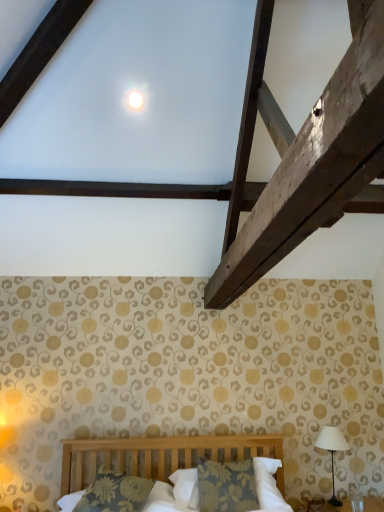
I want to click on white fabric-covered lampshade at right, so click(332, 451).

The image size is (384, 512). Describe the element at coordinates (135, 100) in the screenshot. I see `white glossy moonlight at upper center` at that location.

What is the approximate width of floral fabric pillow at center, marked as the first pillow in a right-to-left arrangement?

The width of floral fabric pillow at center, marked as the first pillow in a right-to-left arrangement, is 13.60 inches.

Identify the location of floral-patterned fabric pillow at center, positioned as the second pillow in right-to-left order. (115, 493).

What's the angular difference between floral-patterned fabric pillow at center, the 1th pillow from the left, and white fabric-covered lampshade at right's facing directions?

The angle between the facing direction of floral-patterned fabric pillow at center, the 1th pillow from the left, and the facing direction of white fabric-covered lampshade at right is 12.6 degrees.

From the white fabric-covered lampshade at right, count the 2nd pillow to the left and point to it. Please provide its 2D coordinates.

[(115, 493)]

Is floral-patterned fabric pillow at center, the 1th pillow from the left, thinner than white fabric-covered lampshade at right?

Incorrect, the width of floral-patterned fabric pillow at center, the 1th pillow from the left, is not less than that of white fabric-covered lampshade at right.

Looking at this image, does floral-patterned fabric pillow at center, positioned as the second pillow in right-to-left order, come behind white fabric-covered lampshade at right?

No, floral-patterned fabric pillow at center, positioned as the second pillow in right-to-left order, is closer to the camera.

Measure the distance from white fabric-covered lampshade at right to white glossy moonlight at upper center.

The distance of white fabric-covered lampshade at right from white glossy moonlight at upper center is 9.09 feet.

Between point (329, 446) and point (136, 105), which one is positioned in front?

The point (136, 105) is closer to the camera.

Considering the relative sizes of white fabric-covered lampshade at right and white glossy moonlight at upper center in the image provided, is white fabric-covered lampshade at right shorter than white glossy moonlight at upper center?

In fact, white fabric-covered lampshade at right may be taller than white glossy moonlight at upper center.

Between white fabric-covered lampshade at right and white glossy moonlight at upper center, which one has larger width?

With larger width is white fabric-covered lampshade at right.

How many degrees apart are the facing directions of floral fabric pillow at center, marked as the first pillow in a right-to-left arrangement, and white glossy moonlight at upper center?

The angle between the facing direction of floral fabric pillow at center, marked as the first pillow in a right-to-left arrangement, and the facing direction of white glossy moonlight at upper center is 14 degrees.

Between floral fabric pillow at center, marked as the first pillow in a right-to-left arrangement, and white glossy moonlight at upper center, which one has more height?

floral fabric pillow at center, marked as the first pillow in a right-to-left arrangement, is taller.

Which is more distant, (260, 463) or (135, 97)?

The point (260, 463) is farther.

Between floral fabric pillow at center, the 2th pillow from the left, and white glossy moonlight at upper center, which one appears on the right side from the viewer's perspective?

floral fabric pillow at center, the 2th pillow from the left, is more to the right.

Considering the relative positions of floral-patterned fabric pillow at center, positioned as the second pillow in right-to-left order, and floral fabric pillow at center, marked as the first pillow in a right-to-left arrangement, in the image provided, is floral-patterned fabric pillow at center, positioned as the second pillow in right-to-left order, behind floral fabric pillow at center, marked as the first pillow in a right-to-left arrangement,?

No.

Considering the relative sizes of floral-patterned fabric pillow at center, the 1th pillow from the left, and floral fabric pillow at center, marked as the first pillow in a right-to-left arrangement, in the image provided, is floral-patterned fabric pillow at center, the 1th pillow from the left, thinner than floral fabric pillow at center, marked as the first pillow in a right-to-left arrangement,?

No, floral-patterned fabric pillow at center, the 1th pillow from the left, is not thinner than floral fabric pillow at center, marked as the first pillow in a right-to-left arrangement.

Is floral-patterned fabric pillow at center, positioned as the second pillow in right-to-left order, in contact with floral fabric pillow at center, marked as the first pillow in a right-to-left arrangement?

floral-patterned fabric pillow at center, positioned as the second pillow in right-to-left order, and floral fabric pillow at center, marked as the first pillow in a right-to-left arrangement, are not in contact.

Consider the image. Is floral-patterned fabric pillow at center, positioned as the second pillow in right-to-left order, at the left side of floral fabric pillow at center, the 2th pillow from the left?

Correct, you'll find floral-patterned fabric pillow at center, positioned as the second pillow in right-to-left order, to the left of floral fabric pillow at center, the 2th pillow from the left.

Which is in front, point (130, 103) or point (335, 504)?

Point (130, 103)

From a real-world perspective, is white glossy moonlight at upper center above or below white fabric-covered lampshade at right?

A: Clearly, from a real-world perspective, white glossy moonlight at upper center is above white fabric-covered lampshade at right.

Can white fabric-covered lampshade at right be found inside white glossy moonlight at upper center?

Definitely not — white fabric-covered lampshade at right is not inside white glossy moonlight at upper center.

Can you confirm if white glossy moonlight at upper center is thinner than white fabric-covered lampshade at right?

Yes, white glossy moonlight at upper center is thinner than white fabric-covered lampshade at right.

Choose the correct answer: Is floral fabric pillow at center, marked as the first pillow in a right-to-left arrangement, inside white fabric-covered lampshade at right or outside it?

floral fabric pillow at center, marked as the first pillow in a right-to-left arrangement, is spatially situated outside white fabric-covered lampshade at right.

From a real-world perspective, who is located higher, floral fabric pillow at center, the 2th pillow from the left, or white fabric-covered lampshade at right?

white fabric-covered lampshade at right is physically above.

From the image's perspective, between floral fabric pillow at center, marked as the first pillow in a right-to-left arrangement, and white fabric-covered lampshade at right, who is located below?

floral fabric pillow at center, marked as the first pillow in a right-to-left arrangement.

Can you confirm if floral fabric pillow at center, marked as the first pillow in a right-to-left arrangement, is shorter than white fabric-covered lampshade at right?

Yes, floral fabric pillow at center, marked as the first pillow in a right-to-left arrangement, is shorter than white fabric-covered lampshade at right.

Is floral-patterned fabric pillow at center, the 1th pillow from the left, not near white glossy moonlight at upper center?

That's right, there is a large distance between floral-patterned fabric pillow at center, the 1th pillow from the left, and white glossy moonlight at upper center.

Is floral-patterned fabric pillow at center, the 1th pillow from the left, inside or outside of white glossy moonlight at upper center?

floral-patterned fabric pillow at center, the 1th pillow from the left, is outside white glossy moonlight at upper center.

Between floral-patterned fabric pillow at center, the 1th pillow from the left, and white glossy moonlight at upper center, which one has more height?

With more height is floral-patterned fabric pillow at center, the 1th pillow from the left.

Is floral-patterned fabric pillow at center, the 1th pillow from the left, facing away from white glossy moonlight at upper center?

No, white glossy moonlight at upper center is not at the back of floral-patterned fabric pillow at center, the 1th pillow from the left.

At what (x,y) coordinates should I click in order to perform the action: click on pillow above the white fabric-covered lampshade at right (from the image's perspective). Please return your answer as a coordinate pair (x, y). Image resolution: width=384 pixels, height=512 pixels. Looking at the image, I should click on (115, 493).

Identify the location of table lamp below the white glossy moonlight at upper center (from a real-world perspective). (332, 451).

Estimate the real-world distances between objects in this image. Which object is closer to white glossy moonlight at upper center, white fabric-covered lampshade at right or floral fabric pillow at center, marked as the first pillow in a right-to-left arrangement?

floral fabric pillow at center, marked as the first pillow in a right-to-left arrangement, is closer to white glossy moonlight at upper center.

From the image, which object appears to be farther from white glossy moonlight at upper center, white fabric-covered lampshade at right or floral-patterned fabric pillow at center, the 1th pillow from the left?

The object further to white glossy moonlight at upper center is white fabric-covered lampshade at right.

Based on their spatial positions, is floral fabric pillow at center, the 2th pillow from the left, or floral-patterned fabric pillow at center, positioned as the second pillow in right-to-left order, closer to white glossy moonlight at upper center?

floral-patterned fabric pillow at center, positioned as the second pillow in right-to-left order.

When comparing their distances from white glossy moonlight at upper center, does floral-patterned fabric pillow at center, positioned as the second pillow in right-to-left order, or floral fabric pillow at center, marked as the first pillow in a right-to-left arrangement, seem closer?

Among the two, floral-patterned fabric pillow at center, positioned as the second pillow in right-to-left order, is located nearer to white glossy moonlight at upper center.

Which object lies nearer to the anchor point floral fabric pillow at center, the 2th pillow from the left, white fabric-covered lampshade at right or floral-patterned fabric pillow at center, the 1th pillow from the left?

Based on the image, floral-patterned fabric pillow at center, the 1th pillow from the left, appears to be nearer to floral fabric pillow at center, the 2th pillow from the left.

When comparing their distances from floral-patterned fabric pillow at center, the 1th pillow from the left, does white fabric-covered lampshade at right or white glossy moonlight at upper center seem further?

white glossy moonlight at upper center.

When comparing their distances from floral-patterned fabric pillow at center, positioned as the second pillow in right-to-left order, does white glossy moonlight at upper center or white fabric-covered lampshade at right seem further?

white glossy moonlight at upper center.

Considering their positions, is floral-patterned fabric pillow at center, the 1th pillow from the left, positioned further to white fabric-covered lampshade at right than floral fabric pillow at center, the 2th pillow from the left?

floral-patterned fabric pillow at center, the 1th pillow from the left.

This screenshot has height=512, width=384. I want to click on pillow between white glossy moonlight at upper center and floral fabric pillow at center, the 2th pillow from the left, in the vertical direction, so click(115, 493).

I want to click on pillow between floral-patterned fabric pillow at center, positioned as the second pillow in right-to-left order, and white fabric-covered lampshade at right, so click(265, 486).

You are a GUI agent. You are given a task and a screenshot of the screen. Output one action in this format:
    pyautogui.click(x=<x>, y=<y>)
    Task: Click on the table lamp between white glossy moonlight at upper center and floral fabric pillow at center, marked as the first pillow in a right-to-left arrangement, from top to bottom
    
    Given the screenshot: What is the action you would take?
    pyautogui.click(x=332, y=451)

Find the location of a particular element. pillow between white glossy moonlight at upper center and white fabric-covered lampshade at right in the up-down direction is located at coordinates (115, 493).